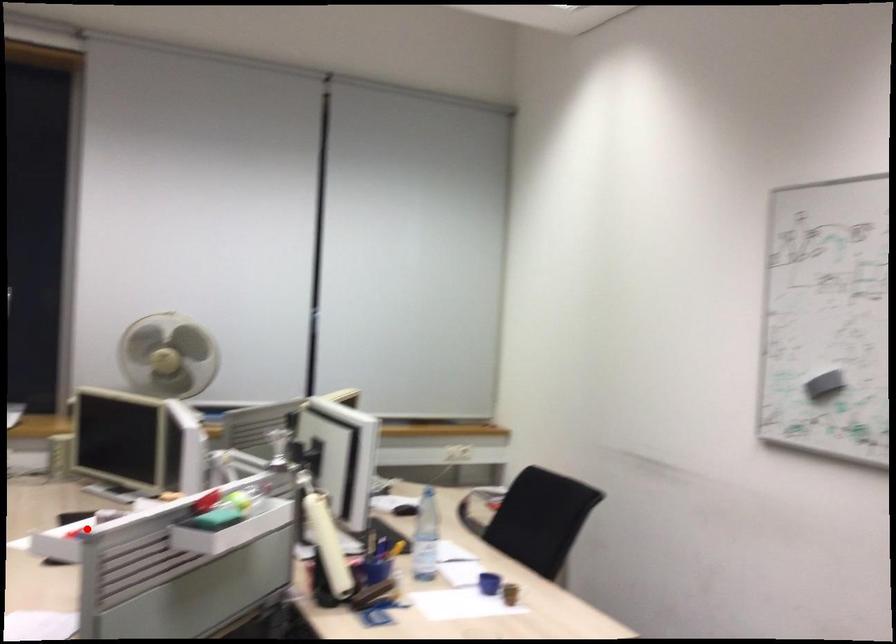
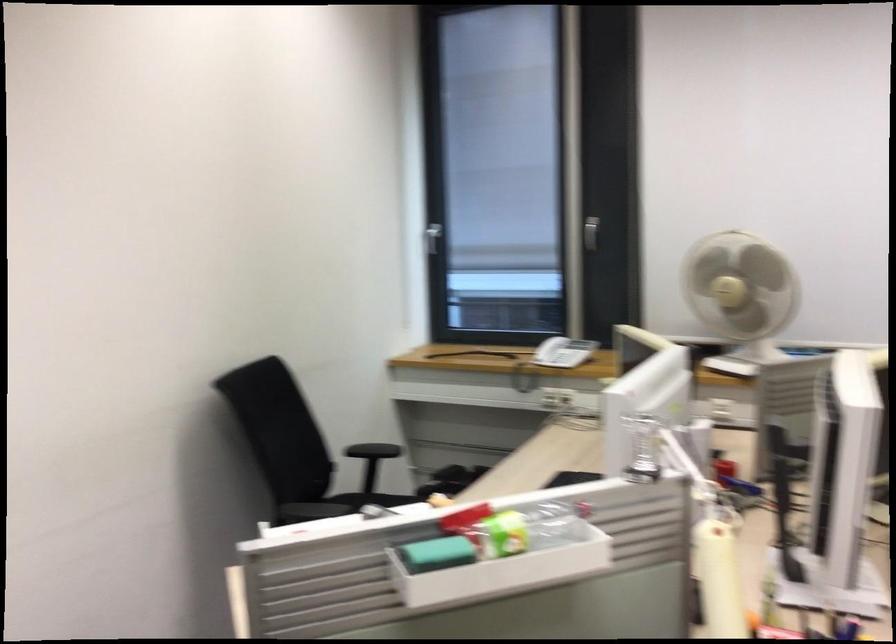
The point at the highlighted location is marked in the first image. Where is the corresponding point in the second image?

(367, 509)